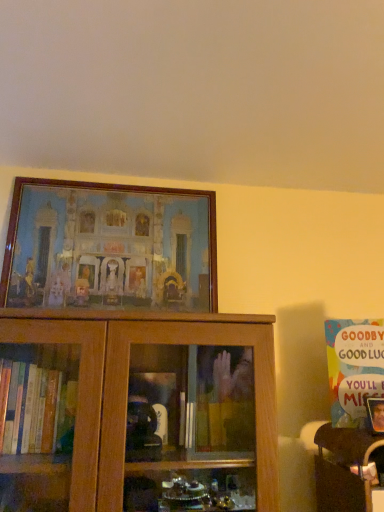
Question: Choose the correct answer: Is multicolored paper card at upper right inside wooden table at lower right or outside it?

Choices:
 (A) outside
 (B) inside

Answer: (A)

Question: Considering the positions of multicolored paper card at upper right and wooden table at lower right in the image, is multicolored paper card at upper right bigger or smaller than wooden table at lower right?

Choices:
 (A) small
 (B) big

Answer: (A)

Question: Which is farther from the wooden table at lower right?

Choices:
 (A) multicolored paper card at upper right
 (B) wooden picture frame at upper center

Answer: (B)

Question: Estimate the real-world distances between objects in this image. Which object is closer to the multicolored paper card at upper right?

Choices:
 (A) wooden table at lower right
 (B) wooden picture frame at upper center

Answer: (A)